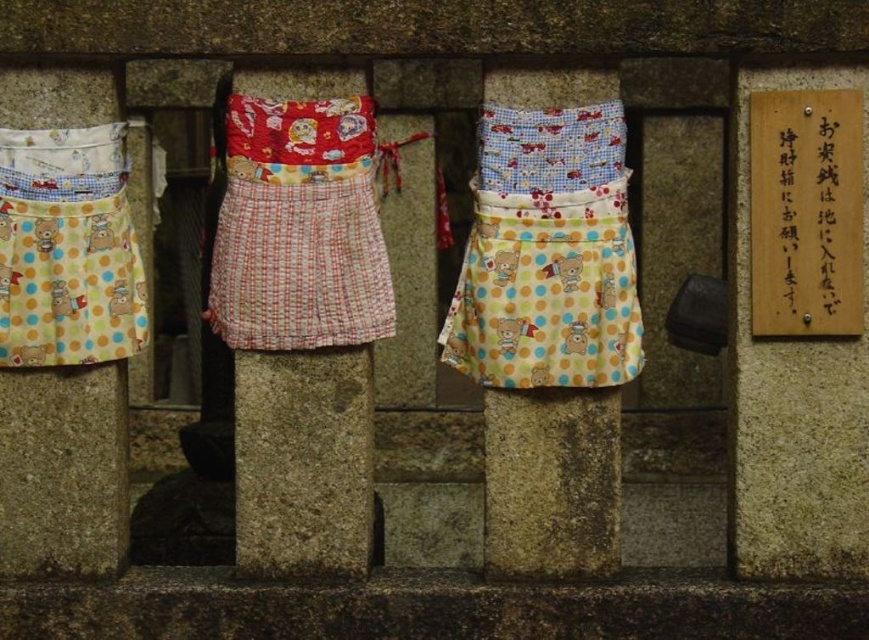
Question: From the image, what is the correct spatial relationship of red plaid apron at center in relation to matte yellow fabric dress at left?

Choices:
 (A) below
 (B) above

Answer: (B)

Question: Which point appears farthest from the camera in this image?

Choices:
 (A) (276, 131)
 (B) (831, 160)
 (C) (562, 417)

Answer: (C)

Question: Among these objects, which one is farthest from the camera?

Choices:
 (A) wooden sign at upper right
 (B) red plaid apron at center
 (C) matte yellow fabric dress at left

Answer: (C)

Question: Where is matte yellow fabric dress at left located in relation to yellow polka dot fabric apron at center in the image?

Choices:
 (A) right
 (B) left

Answer: (B)

Question: Which of the following is the closest to the observer?

Choices:
 (A) (363, 289)
 (B) (833, 284)
 (C) (571, 481)

Answer: (B)

Question: Does red plaid apron at center have a greater width compared to yellow polka dot fabric apron at center?

Choices:
 (A) no
 (B) yes

Answer: (B)